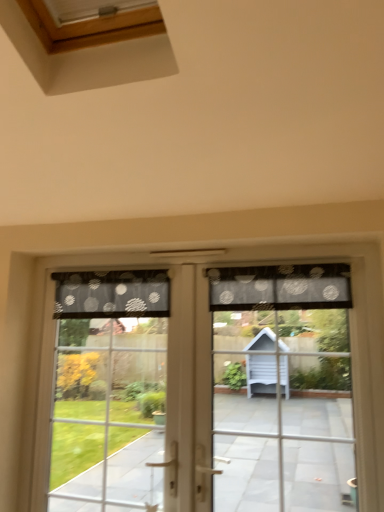
Find the location of a particular element. vacant area on top of black dotted fabric at upper center, which is the 2th curtain in left-to-right order (from a real-world perspective) is located at coordinates (269, 260).